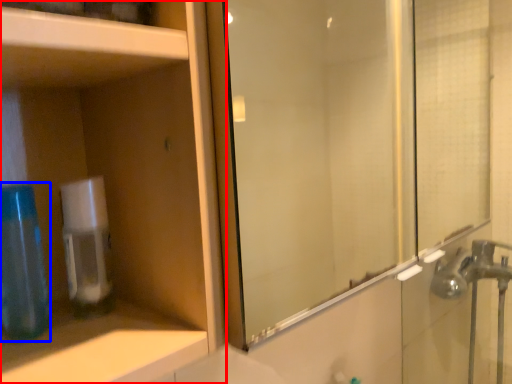
Question: Which of the following is the closest to the observer, cabinetry (highlighted by a red box) or mouthwash (highlighted by a blue box)?

Choices:
 (A) cabinetry
 (B) mouthwash

Answer: (A)